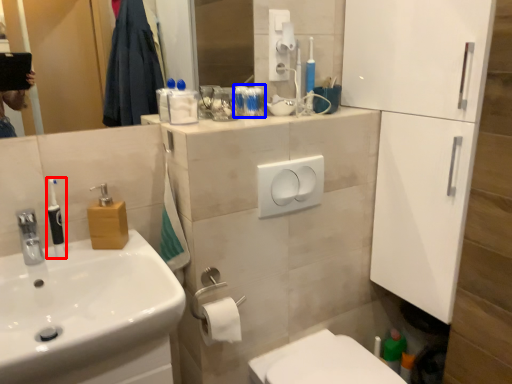
Question: Which object appears farthest to the camera in this image, toiletry (highlighted by a red box) or toiletry (highlighted by a blue box)?

Choices:
 (A) toiletry
 (B) toiletry

Answer: (B)